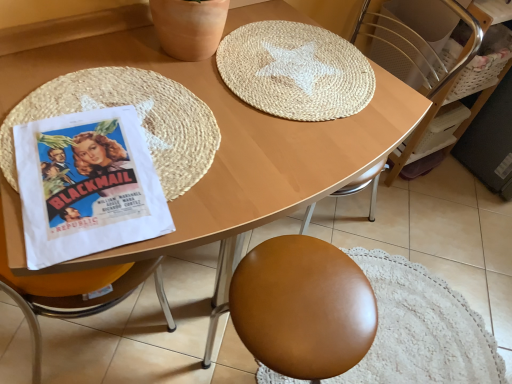
Where is `free point behind woven straw placemat at left, the first mat from the left`? This screenshot has width=512, height=384. free point behind woven straw placemat at left, the first mat from the left is located at coordinates (200, 59).